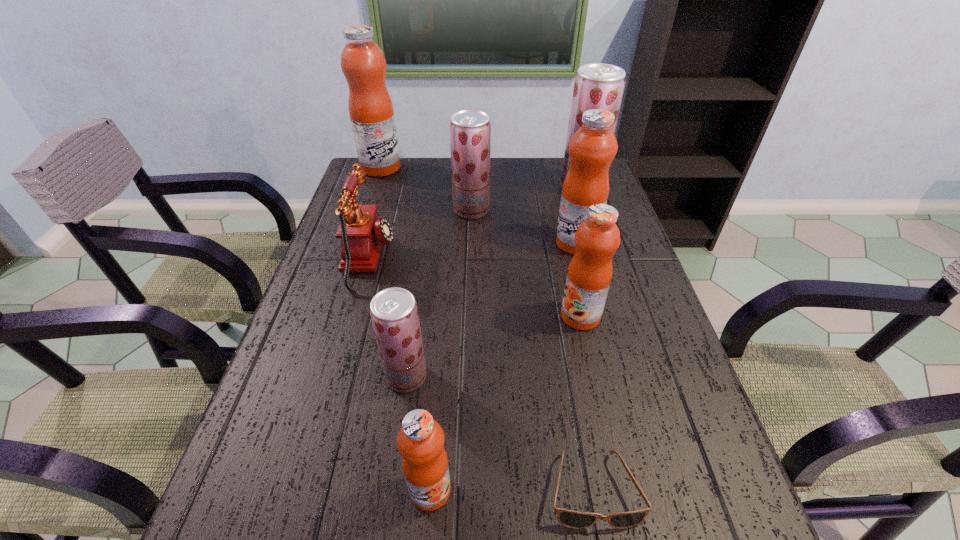
The image size is (960, 540). I want to click on vacant area situated on the front label of the third farthest orange fruit juice, so click(x=451, y=316).

At what (x,y) coordinates should I click in order to perform the action: click on free location located on the front label of the third farthest orange fruit juice. Please return your answer as a coordinate pair (x, y). The image size is (960, 540). Looking at the image, I should click on (523, 316).

Where is `free space located on the front label of the third farthest orange fruit juice`? The image size is (960, 540). free space located on the front label of the third farthest orange fruit juice is located at coordinates (472, 316).

Identify the location of free point located 0.180m on the dial of the telephone. The width and height of the screenshot is (960, 540). (460, 259).

You are a GUI agent. You are given a task and a screenshot of the screen. Output one action in this format:
    pyautogui.click(x=<x>, y=<y>)
    Task: Click on the vacant space located on the back of the smallest strawberry fruit juice
    This screenshot has height=540, width=960.
    Given the screenshot: What is the action you would take?
    pyautogui.click(x=420, y=276)

The height and width of the screenshot is (540, 960). I want to click on fruit juice positioned at the left edge, so click(x=363, y=64).

Find the location of `telephone that is positioned at the left edge`. telephone that is positioned at the left edge is located at coordinates (362, 233).

The width and height of the screenshot is (960, 540). In order to click on sunglasses present at the right edge in this screenshot , I will do `click(573, 519)`.

Find the location of a particular element. This screenshot has height=540, width=960. object situated at the far left corner is located at coordinates (363, 64).

Identify the location of object that is positioned at the far right corner. (597, 85).